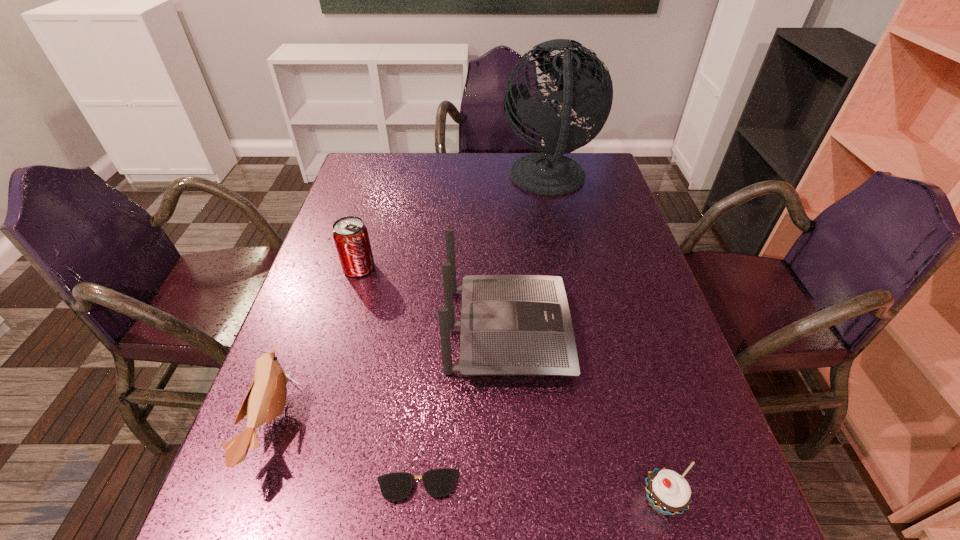
The height and width of the screenshot is (540, 960). In order to click on the farthest object in this screenshot , I will do `click(587, 85)`.

Locate an element on the screen. Image resolution: width=960 pixels, height=540 pixels. the tallest object is located at coordinates (587, 85).

Locate an element on the screen. This screenshot has width=960, height=540. the fifth shortest object is located at coordinates (510, 324).

Locate an element on the screen. the second farthest object is located at coordinates (350, 235).

At what (x,y) coordinates should I click in order to perform the action: click on pop soda. Please return your answer as a coordinate pair (x, y). The image size is (960, 540). Looking at the image, I should click on (350, 235).

The height and width of the screenshot is (540, 960). Identify the location of bird. (266, 398).

You are a GUI agent. You are given a task and a screenshot of the screen. Output one action in this format:
    pyautogui.click(x=<x>, y=<y>)
    Task: Click on the second shortest object
    The width and height of the screenshot is (960, 540).
    Given the screenshot: What is the action you would take?
    pyautogui.click(x=668, y=493)

Find the location of a particular element. the shortest object is located at coordinates (440, 482).

I want to click on vacant space located 0.310m on the front-facing side of the globe, so click(406, 180).

At what (x,y) coordinates should I click in order to perform the action: click on vacant space located on the front-facing side of the globe. Please return your answer as a coordinate pair (x, y). Looking at the image, I should click on (413, 180).